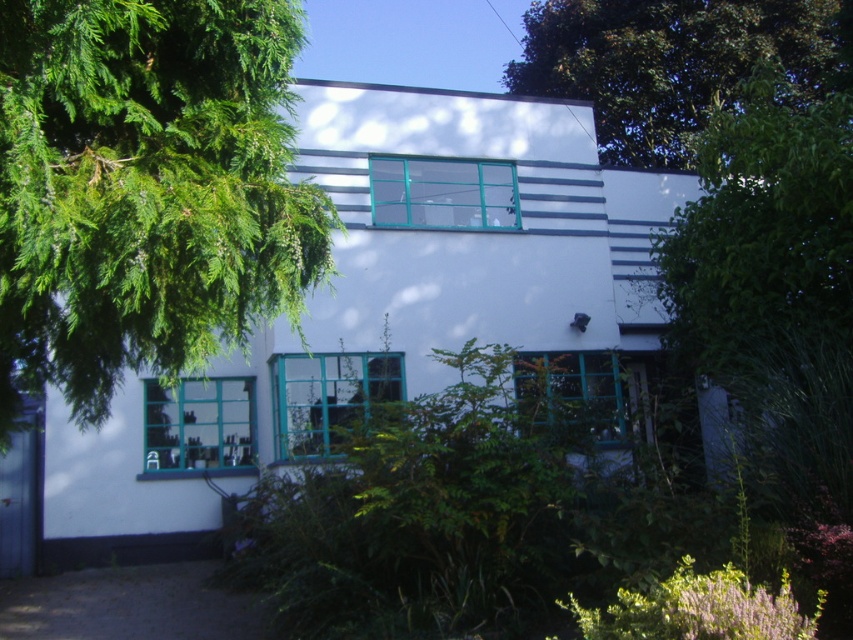
Is green leafy branch at left thinner than green leafy tree at right?

Incorrect, green leafy branch at left's width is not less than green leafy tree at right's.

Who is more forward, (10, 42) or (815, 164)?

Positioned in front is point (10, 42).

Where is `green leafy branch at left`? The width and height of the screenshot is (853, 640). green leafy branch at left is located at coordinates (144, 189).

Consider the image. Is green leafy branch at left further to the viewer compared to green leafy tree at upper center?

No, it is not.

Can you confirm if green leafy branch at left is taller than green leafy tree at upper center?

Incorrect, green leafy branch at left's height is not larger of green leafy tree at upper center's.

Which is behind, point (270, 22) or point (637, 68)?

Positioned behind is point (637, 68).

This screenshot has width=853, height=640. Find the location of `green leafy branch at left`. green leafy branch at left is located at coordinates (144, 189).

Is green leafy tree at right below green leafy tree at upper center?

Yes, green leafy tree at right is below green leafy tree at upper center.

Which of these two, green leafy tree at right or green leafy tree at upper center, stands taller?

Standing taller between the two is green leafy tree at upper center.

At what (x,y) coordinates should I click in order to perform the action: click on green leafy tree at right. Please return your answer as a coordinate pair (x, y). Image resolution: width=853 pixels, height=640 pixels. Looking at the image, I should click on (775, 282).

Find the location of a particular element. green leafy tree at right is located at coordinates (775, 282).